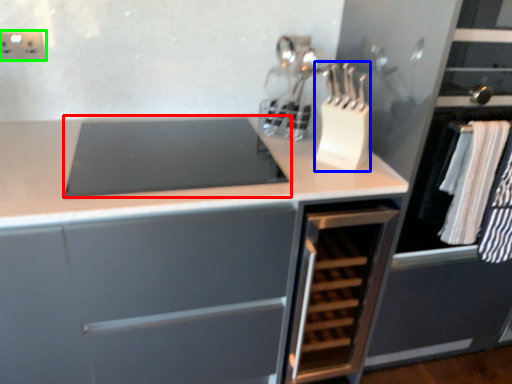
Question: Based on their relative distances, which object is farther from home appliance (highlighted by a red box)? Choose from kitchen appliance (highlighted by a blue box) and electric outlet (highlighted by a green box).

Choices:
 (A) kitchen appliance
 (B) electric outlet

Answer: (B)